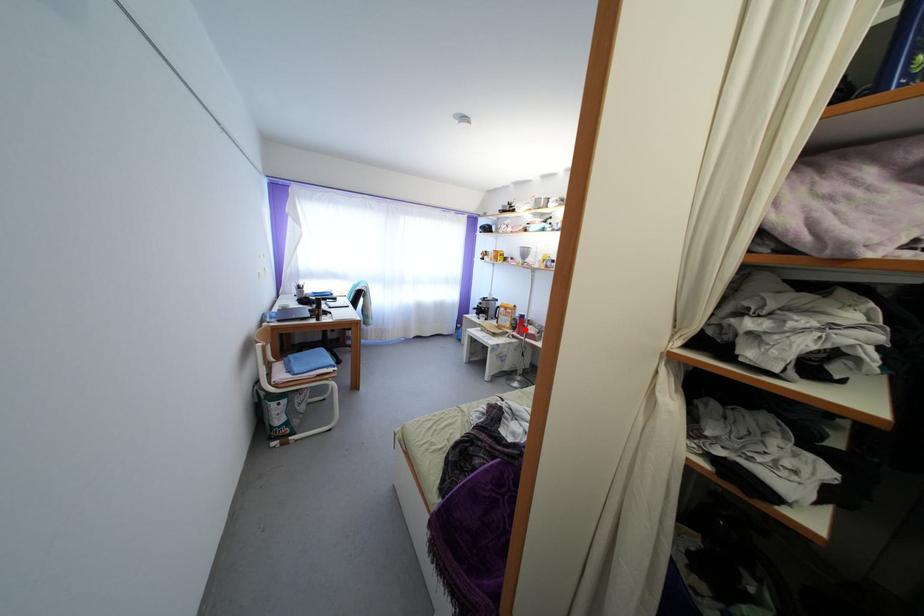
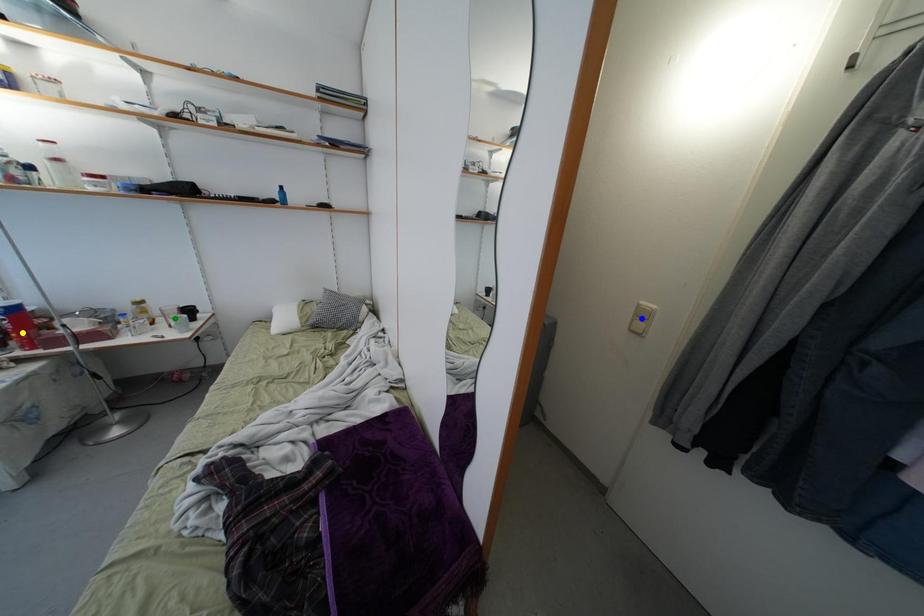
Question: I am providing you with two images of the same scene from different viewpoints. A red point is marked on the first image. You are given multiple points on the second image. Which mark in image 2 goes with the point in image 1?

Choices:
 (A) blue point
 (B) yellow point
 (C) green point

Answer: (B)